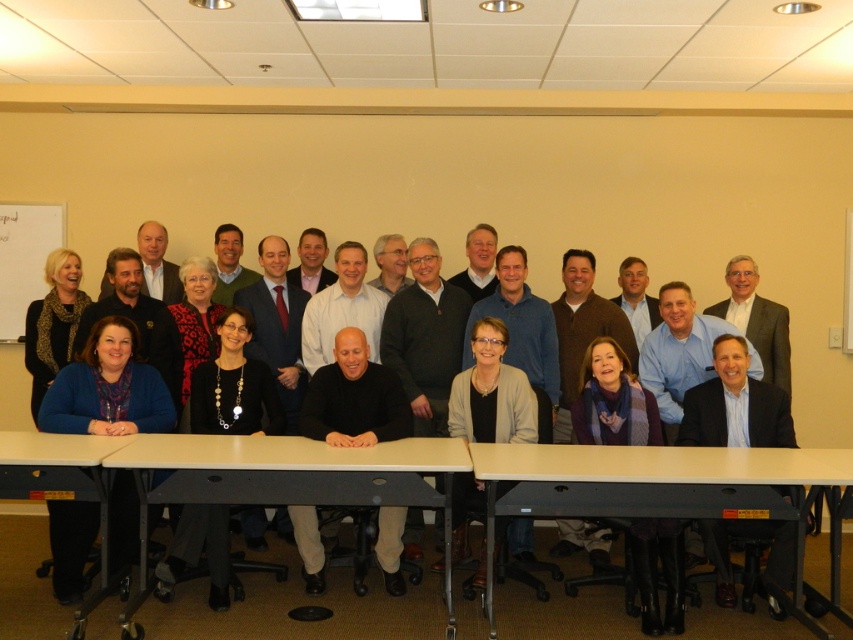
You are a person of average height standing in the room. You want to place a laptop on the surface that is lower between the light brown laminate table at lower center and the whiteboard at upper left. Which object should you choose?

The light brown laminate table at lower center has a lesser height compared to the whiteboard at upper left, so you should place the laptop on the light brown laminate table at lower center.

In the scene described, where is the white plastic table at center located relative to the whiteboard at upper left?

The white plastic table at center is located to the right of the whiteboard at upper left.

You are standing at the entrance of the room and want to reach both the black sweater at center and the whiteboard at upper left. Which object will you encounter first as you walk straight ahead?

You will encounter the black sweater at center first because it is closer to the viewer than the whiteboard at upper left.